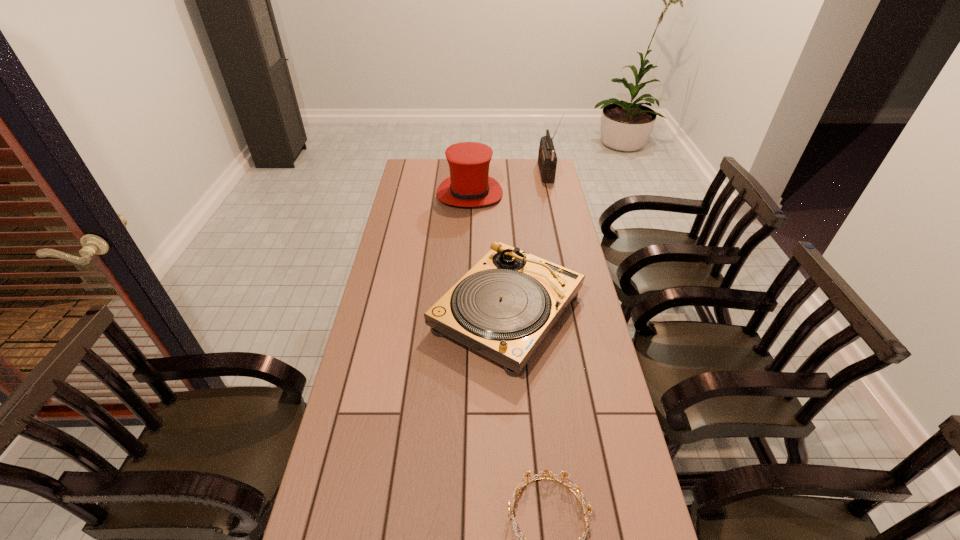
What are the coordinates of `the tallest object` in the screenshot? It's located at (547, 159).

Locate an element on the screen. hat is located at coordinates (469, 185).

Where is `record player`? This screenshot has width=960, height=540. record player is located at coordinates (506, 304).

This screenshot has height=540, width=960. I want to click on the second shortest object, so click(506, 304).

I want to click on free region located 0.330m on the front-facing side of the radio receiver, so click(x=472, y=172).

Locate an element on the screen. vacant space positioned on the front-facing side of the radio receiver is located at coordinates (487, 172).

Find the location of `vacant point located 0.120m on the front-facing side of the radio receiver`. vacant point located 0.120m on the front-facing side of the radio receiver is located at coordinates [516, 172].

I want to click on vacant space located 0.360m on the front of the third shortest object, so click(x=468, y=265).

This screenshot has height=540, width=960. In order to click on vacant space located on the back of the record player in this screenshot , I will do `click(503, 240)`.

In order to click on radio receiver that is at the far edge in this screenshot , I will do `click(547, 159)`.